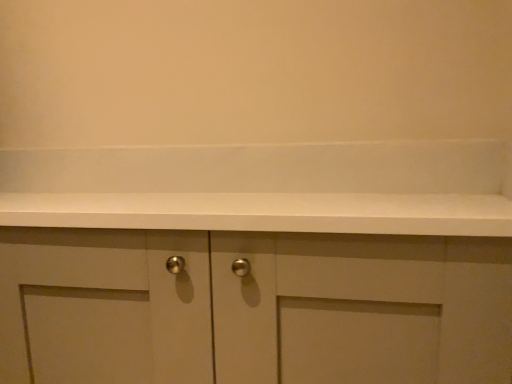
The height and width of the screenshot is (384, 512). I want to click on free space above white matte cabinet doors at center (from a real-world perspective), so click(x=234, y=195).